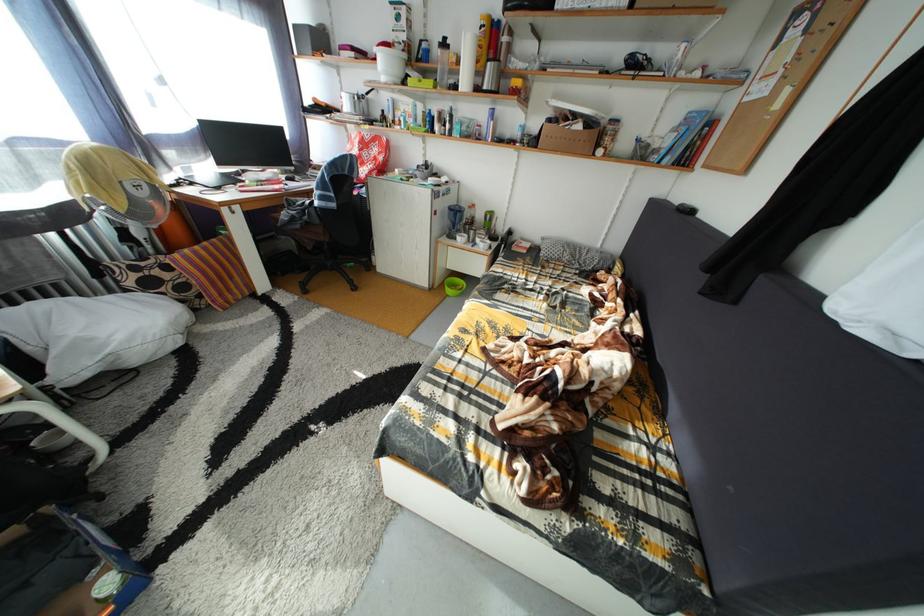
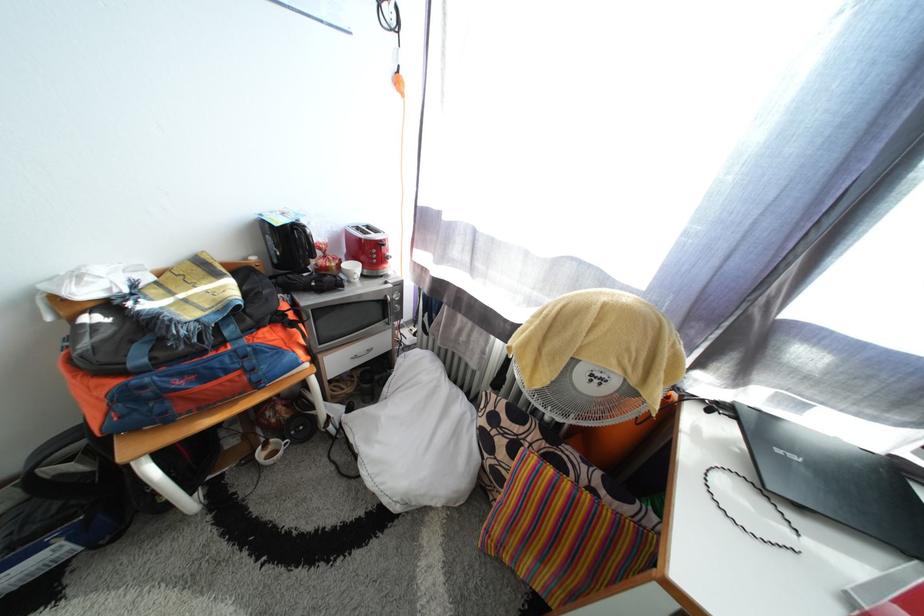
Locate, in the second image, the point that corresponds to the point at 203,259 in the first image.

(563, 493)